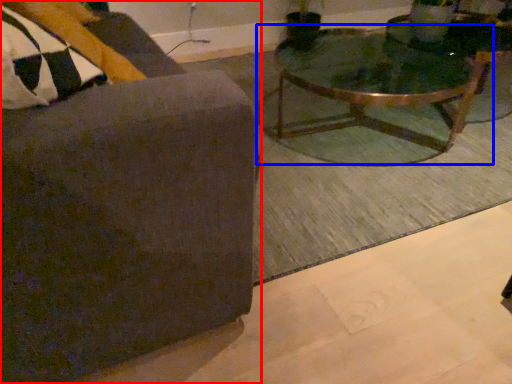
Question: Which object is further to the camera taking this photo, chair (highlighted by a red box) or coffee table (highlighted by a blue box)?

Choices:
 (A) chair
 (B) coffee table

Answer: (B)